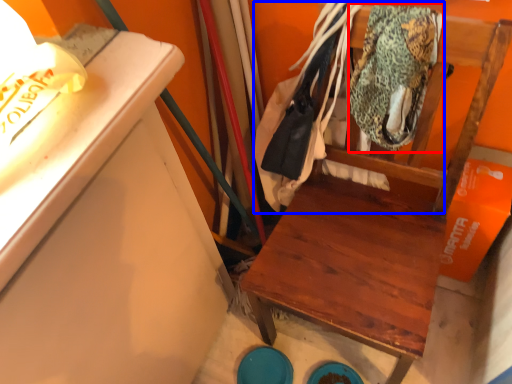
Question: Among these objects, which one is nearest to the camera, clothing (highlighted by a red box) or laundry (highlighted by a blue box)?

Choices:
 (A) clothing
 (B) laundry

Answer: (B)